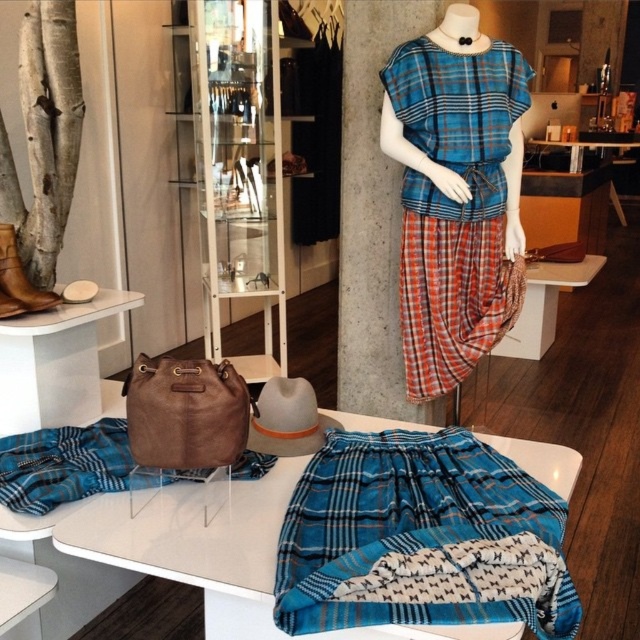
You are a customer in the store and want to pick up both the blue plaid skirt at center and the brown leather boot at left. Which one should you approach first if you are standing to the right of both items?

→ You should approach the brown leather boot at left first because it is closer to your current position on the right side.

You are standing in the store and want to reach both the point at coordinates point (435,436) and the point at coordinates point (3,307). Which point is closer to you?

Point point (435,436) is further to the viewer than point point (3,307), so the point at coordinates point (3,307) is closer to you.